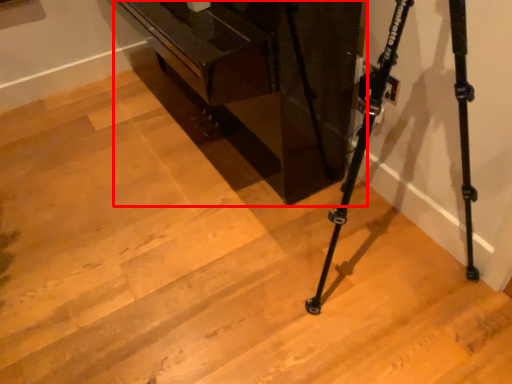
Question: From the image, what is the correct spatial relationship of furniture (annotated by the red box) in relation to tripod?

Choices:
 (A) left
 (B) right

Answer: (A)